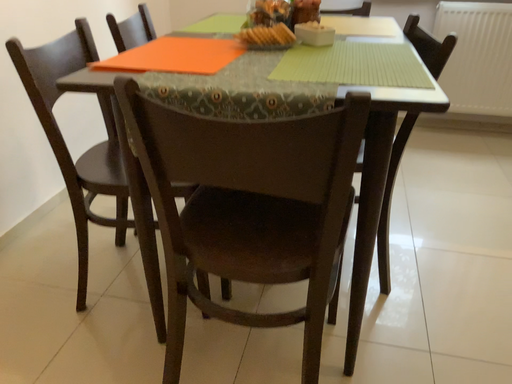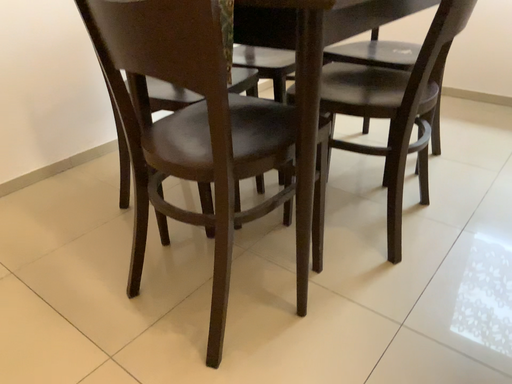
Question: Which way did the camera rotate in the video?

Choices:
 (A) rotated left
 (B) rotated right

Answer: (A)